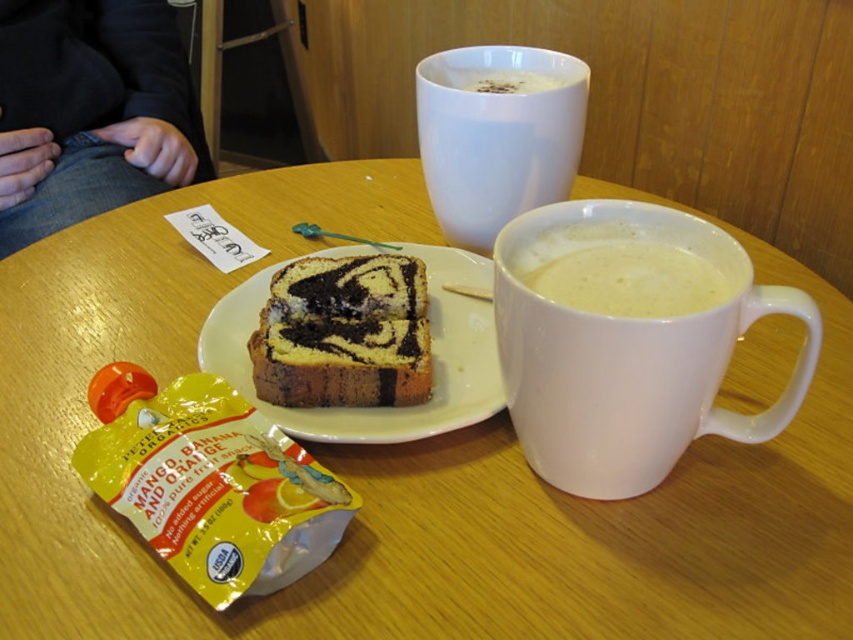
Question: In this image, where is swirled chocolate cake at center located relative to yellow matte plastic at center?

Choices:
 (A) above
 (B) below

Answer: (A)

Question: Estimate the real-world distances between objects in this image. Which object is closer to the white matte mug at upper center?

Choices:
 (A) white matte mug at right
 (B) white frothy coffee at upper center

Answer: (B)

Question: Among these objects, which one is nearest to the camera?

Choices:
 (A) white frothy coffee at upper center
 (B) white glossy mug at upper center
 (C) white matte mug at right
 (D) yellow matte plastic at center

Answer: (B)

Question: Does white glossy mug at upper center appear on the left side of yellow matte plastic at center?

Choices:
 (A) no
 (B) yes

Answer: (A)

Question: Which of the following is the closest to the observer?

Choices:
 (A) white matte mug at right
 (B) white frothy coffee at upper center
 (C) white matte mug at upper center
 (D) swirled chocolate cake at center

Answer: (A)

Question: Is white glossy mug at upper center to the left of swirled chocolate cake at center from the viewer's perspective?

Choices:
 (A) no
 (B) yes

Answer: (A)